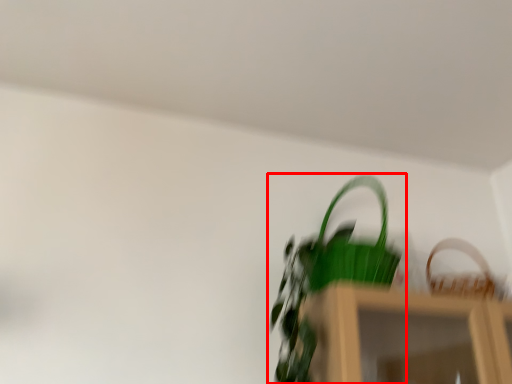
Question: From the image's perspective, considering the relative positions of houseplant (annotated by the red box) and basket in the image provided, where is houseplant (annotated by the red box) located with respect to the staircase?

Choices:
 (A) above
 (B) below

Answer: (A)